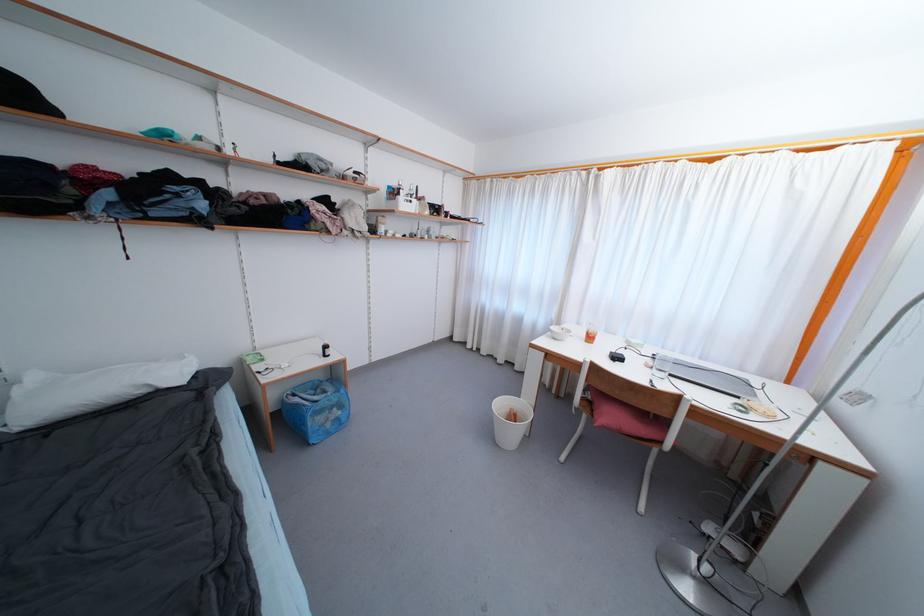
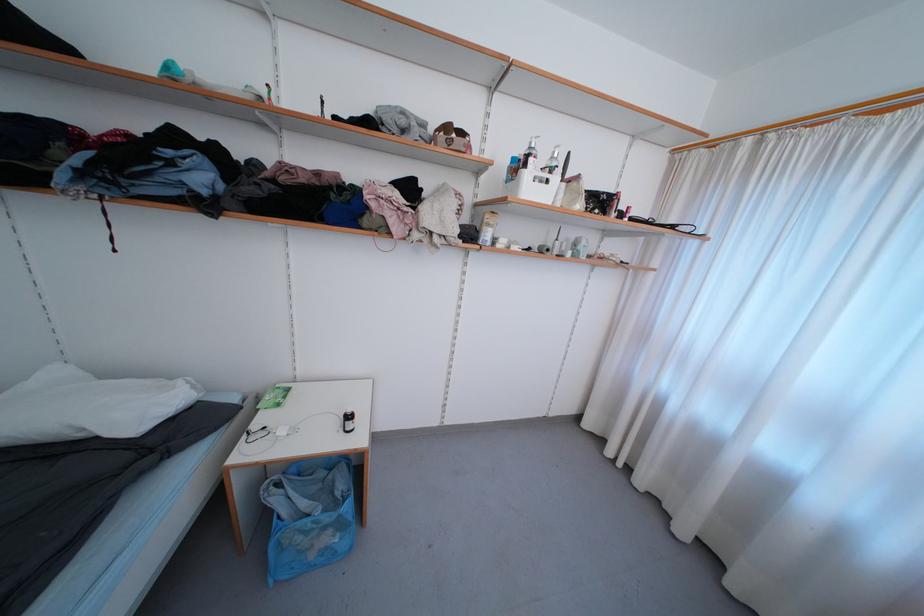
The point at [298,398] is marked in the first image. Where is the corresponding point in the second image?

(284, 488)